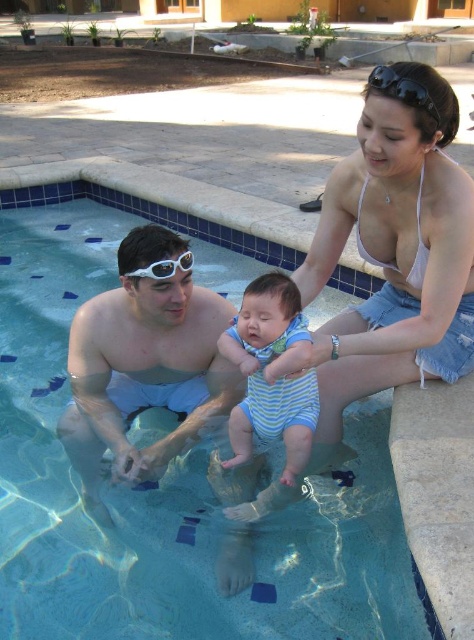
Looking at this image, you are a lifeguard who needs to determine which pair of goggles is taller. You see the white plastic goggles at center and the white matte goggles at upper center. Which one is taller?

The white plastic goggles at center is much taller than the white matte goggles at upper center.

In the scene shown: You are a lifeguard who needs to place a floating rescue buoy between the blue tile swimming pool at center and the black plastic goggles at upper right. Which object should you place the buoy closer to if you want it to be near the wider object?

The blue tile swimming pool at center is wider than the black plastic goggles at upper right, so the buoy should be placed closer to the blue tile swimming pool at center.

You are a photographer trying to capture the blue tile swimming pool at center and the black plastic goggles at upper right in a single shot. Which object should you focus on first to ensure both are in clear view?

You should focus on the blue tile swimming pool at center first because it is closer to the viewer than the black plastic goggles at upper right, ensuring both will be in focus when starting with the closer object.